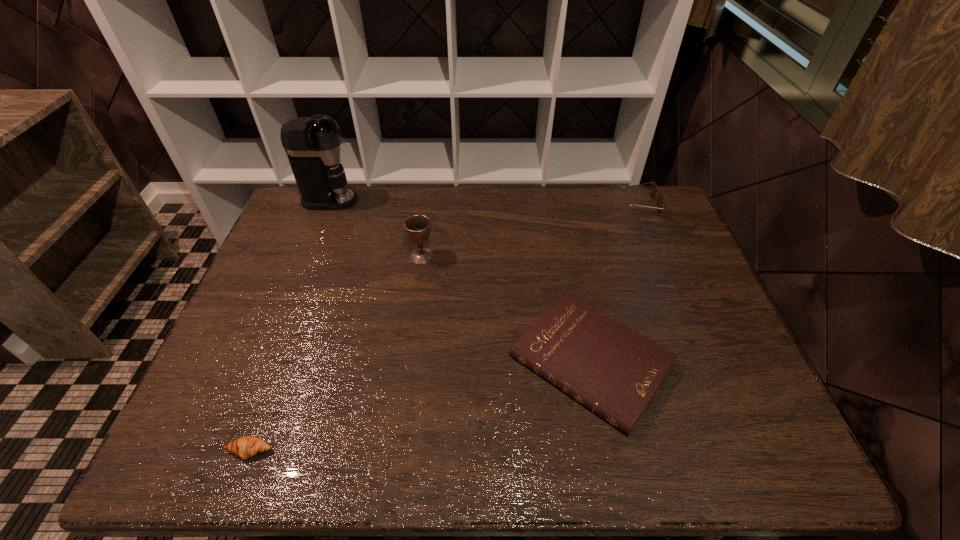
Locate an element on the screen. This screenshot has width=960, height=540. free region that satisfies the following two spatial constraints: 1. on the front-facing side of the rightmost object; 2. on the front-facing side of the nearest object is located at coordinates (743, 451).

Find the location of a particular element. free space that satisfies the following two spatial constraints: 1. place cup under the spout of the third nearest object; 2. on the left side of the coffee maker is located at coordinates (307, 256).

Where is `free space that satisfies the following two spatial constraints: 1. place cup under the spout of the coffee maker; 2. on the back side of the fourth shortest object`? The image size is (960, 540). free space that satisfies the following two spatial constraints: 1. place cup under the spout of the coffee maker; 2. on the back side of the fourth shortest object is located at coordinates (307, 256).

Locate an element on the screen. blank area in the image that satisfies the following two spatial constraints: 1. on the back side of the third nearest object; 2. place cup under the spout of the coffee maker is located at coordinates (429, 200).

Where is `vacant space that satisfies the following two spatial constraints: 1. on the front side of the second nearest object; 2. on the right side of the third farthest object`? The image size is (960, 540). vacant space that satisfies the following two spatial constraints: 1. on the front side of the second nearest object; 2. on the right side of the third farthest object is located at coordinates (407, 361).

Locate an element on the screen. The height and width of the screenshot is (540, 960). vacant point that satisfies the following two spatial constraints: 1. place cup under the spout of the coffee maker; 2. on the back side of the chalice is located at coordinates (307, 256).

Identify the location of vacant region that satisfies the following two spatial constraints: 1. place cup under the spout of the coffee maker; 2. on the right side of the third farthest object. (307, 256).

At what (x,y) coordinates should I click in order to perform the action: click on vacant space that satisfies the following two spatial constraints: 1. on the front-facing side of the third shortest object; 2. on the front side of the hardback book. Please return your answer as a coordinate pair (x, y). The height and width of the screenshot is (540, 960). Looking at the image, I should click on (707, 361).